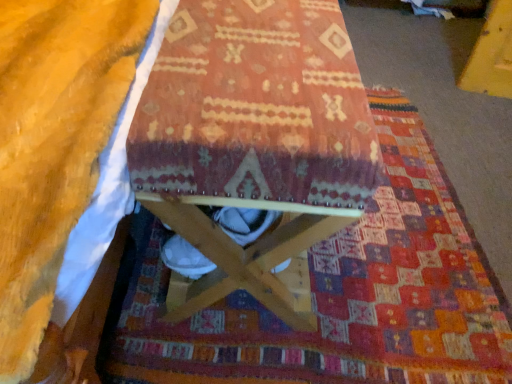
This screenshot has width=512, height=384. Find the location of `free space above wooden stool at center (from a real-world perspective)`. free space above wooden stool at center (from a real-world perspective) is located at coordinates (263, 44).